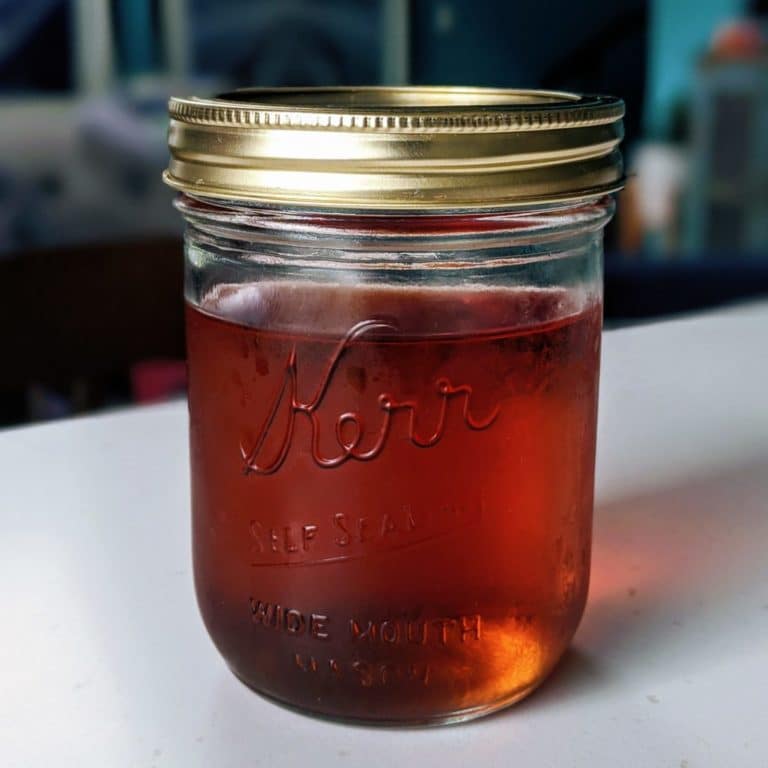
In order to click on white surface to right of jar in this screenshot , I will do `click(667, 366)`.